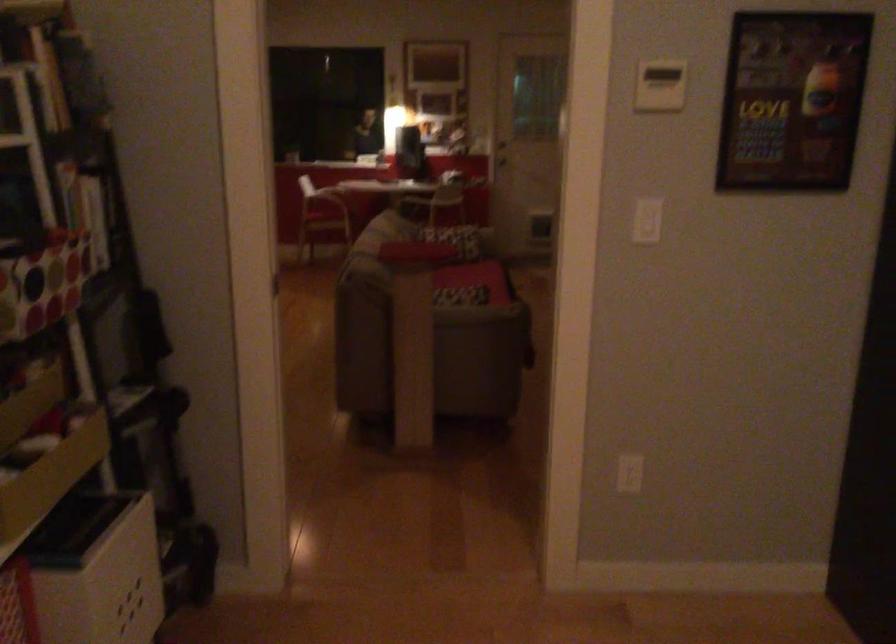
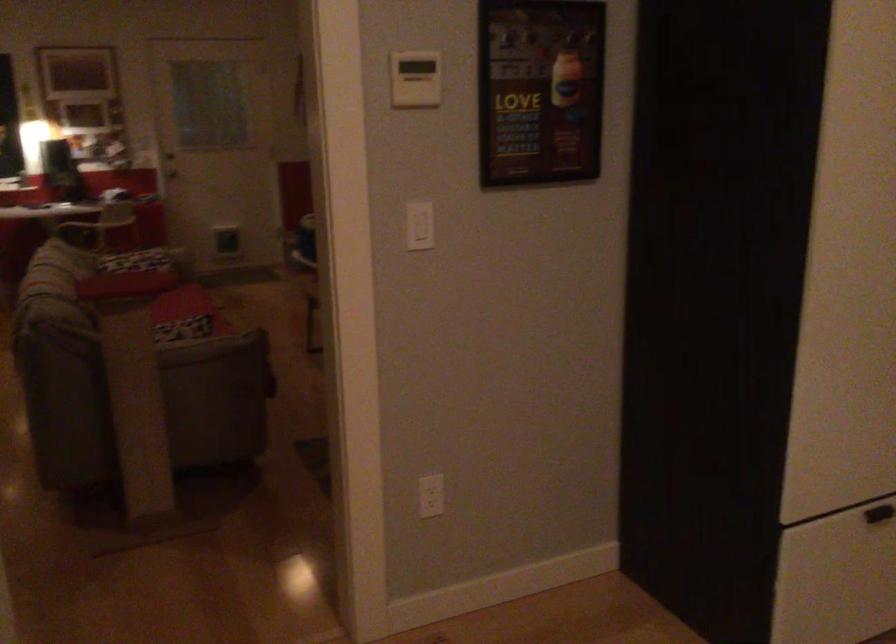
Find the pixel in the second image that matches (467,277) in the first image.

(176, 308)